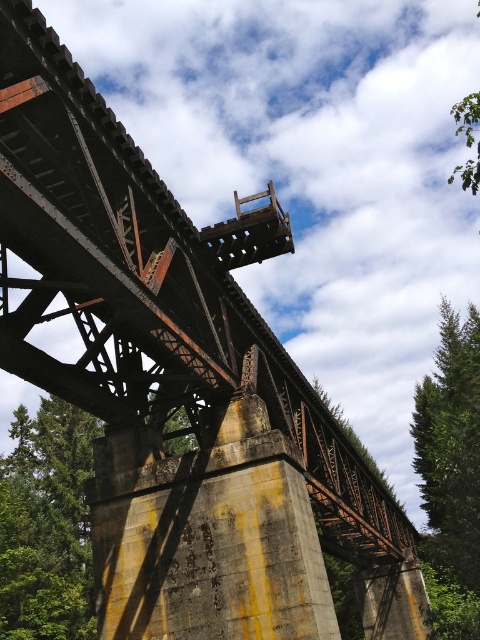
Between green leafy tree at lower left and green textured tree at right, which one is positioned lower?

green leafy tree at lower left

Between point (15, 636) and point (462, 611), which one is positioned behind?

The point (462, 611) is behind.

The width and height of the screenshot is (480, 640). Describe the element at coordinates (47, 524) in the screenshot. I see `green leafy tree at lower left` at that location.

In order to click on green leafy tree at lower left in this screenshot , I will do `click(47, 524)`.